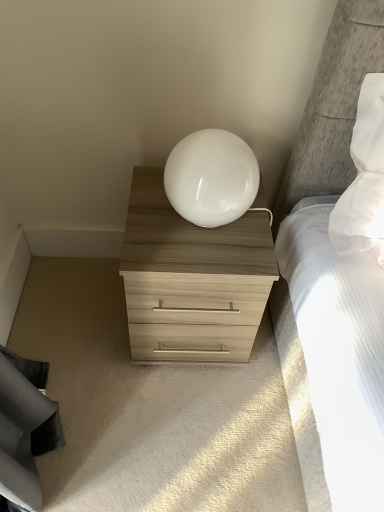
Question: Based on their sizes in the image, would you say light wood/texture chest of drawers at center is bigger or smaller than white glossy sphere at center?

Choices:
 (A) big
 (B) small

Answer: (A)

Question: From the image's perspective, relative to white glossy sphere at center, is light wood/texture chest of drawers at center above or below?

Choices:
 (A) below
 (B) above

Answer: (A)

Question: Is light wood/texture chest of drawers at center in front of or behind white glossy sphere at center in the image?

Choices:
 (A) behind
 (B) front

Answer: (A)

Question: Considering the positions of white glossy sphere at center and light wood/texture chest of drawers at center in the image, is white glossy sphere at center bigger or smaller than light wood/texture chest of drawers at center?

Choices:
 (A) small
 (B) big

Answer: (A)

Question: Considering their positions, is white glossy sphere at center located in front of or behind light wood/texture chest of drawers at center?

Choices:
 (A) front
 (B) behind

Answer: (A)

Question: Would you say white glossy sphere at center is inside or outside light wood/texture chest of drawers at center?

Choices:
 (A) outside
 (B) inside

Answer: (A)

Question: Based on their positions, is white glossy sphere at center located to the left or right of light wood/texture chest of drawers at center?

Choices:
 (A) right
 (B) left

Answer: (A)